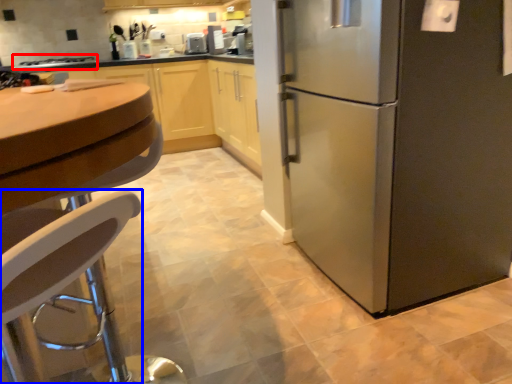
Question: Which point is further to the camera, stove (highlighted by a red box) or chair (highlighted by a blue box)?

Choices:
 (A) stove
 (B) chair

Answer: (A)